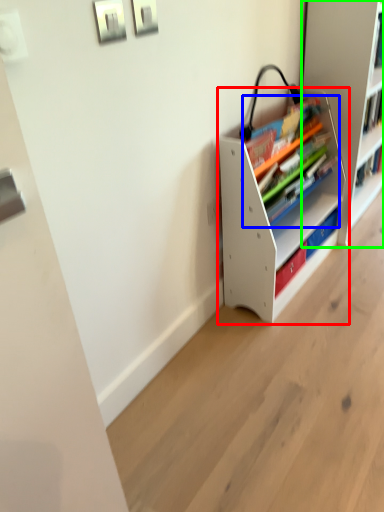
Question: Based on their relative distances, which object is farther from shelf (highlighted by a red box)? Choose from book (highlighted by a blue box) and shelf (highlighted by a green box).

Choices:
 (A) book
 (B) shelf

Answer: (B)